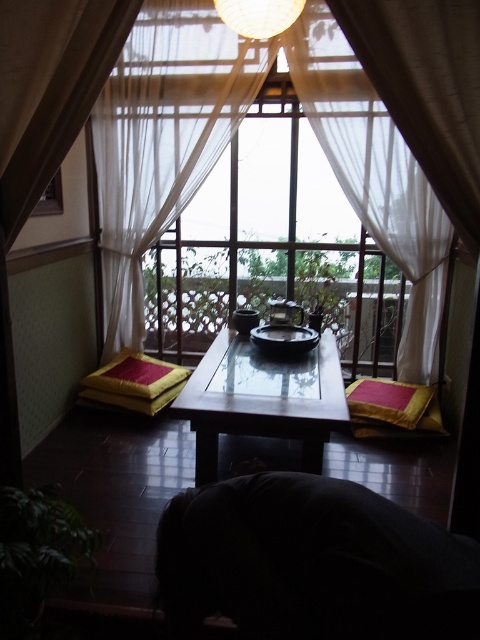
Between velvet-like red cushion at lower right and yellow fabric cushion at lower left, which one is positioned higher?

yellow fabric cushion at lower left

Is velvet-like red cushion at lower right above yellow fabric cushion at lower left?

Incorrect, velvet-like red cushion at lower right is not positioned above yellow fabric cushion at lower left.

Between point (372, 412) and point (127, 384), which one is positioned behind?

Point (127, 384)

You are a GUI agent. You are given a task and a screenshot of the screen. Output one action in this format:
    pyautogui.click(x=<x>, y=<y>)
    Task: Click on the velvet-like red cushion at lower right
    
    Given the screenshot: What is the action you would take?
    pyautogui.click(x=392, y=403)

Does transparent glass table at center have a lesser width compared to yellow fabric cushion at lower left?

No, transparent glass table at center is not thinner than yellow fabric cushion at lower left.

Does transparent glass table at center have a lesser height compared to yellow fabric cushion at lower left?

Incorrect, transparent glass table at center's height does not fall short of yellow fabric cushion at lower left's.

Is point (288, 419) positioned before point (167, 372)?

Yes, point (288, 419) is in front of point (167, 372).

The height and width of the screenshot is (640, 480). Find the location of `transparent glass table at center`. transparent glass table at center is located at coordinates tap(263, 397).

In the scene shown: Can you confirm if white sheer curtain at center is positioned to the left of velvet-like red cushion at lower right?

Indeed, white sheer curtain at center is positioned on the left side of velvet-like red cushion at lower right.

From the picture: Is the position of white sheer curtain at center less distant than that of velvet-like red cushion at lower right?

No, it is behind velvet-like red cushion at lower right.

Who is more distant from viewer, (201, 61) or (425, 419)?

The point (201, 61) is behind.

I want to click on white sheer curtain at center, so click(x=228, y=140).